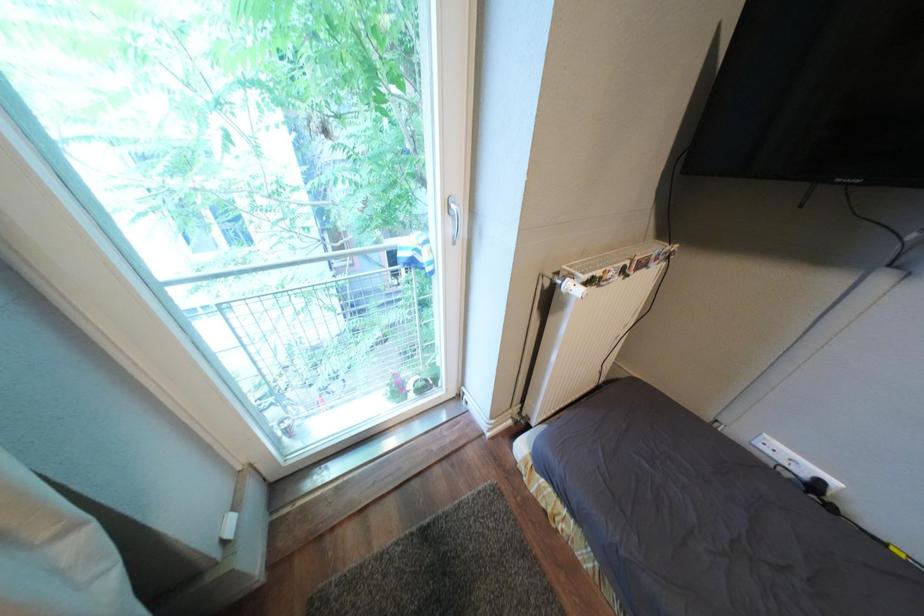
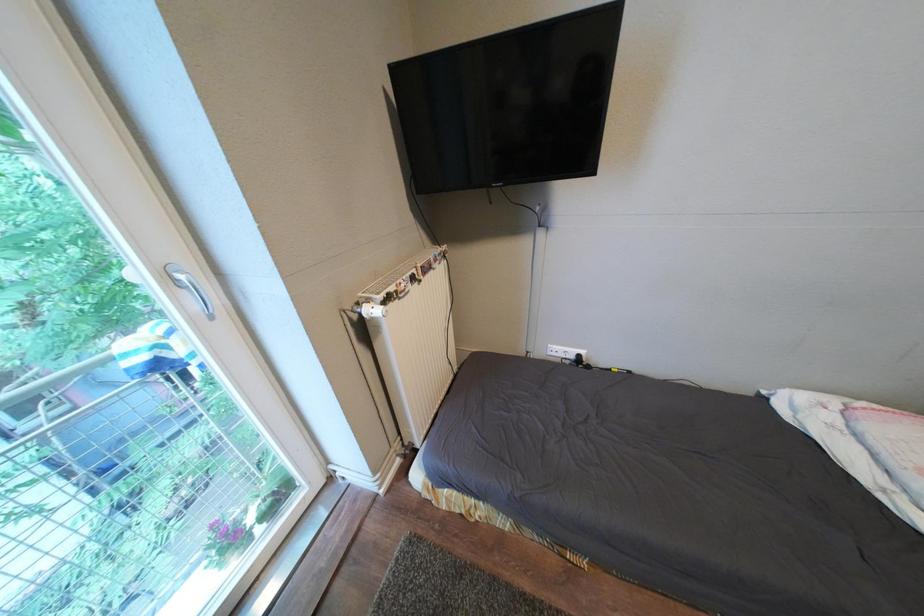
Question: The first image is from the beginning of the video and the second image is from the end. How did the camera likely rotate when shooting the video?

Choices:
 (A) Left
 (B) Right
 (C) Up
 (D) Down

Answer: (B)